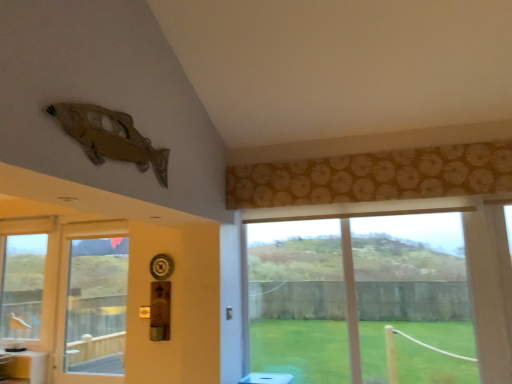
Question: From the image's perspective, is transparent glass door at left located above white glossy counter top at lower left?

Choices:
 (A) yes
 (B) no

Answer: (A)

Question: Is white glossy counter top at lower left at the back of transparent glass door at left?

Choices:
 (A) no
 (B) yes

Answer: (A)

Question: Considering the relative sizes of transparent glass door at left and white glossy counter top at lower left in the image provided, is transparent glass door at left wider than white glossy counter top at lower left?

Choices:
 (A) no
 (B) yes

Answer: (A)

Question: Does transparent glass door at left appear on the right side of white glossy counter top at lower left?

Choices:
 (A) yes
 (B) no

Answer: (A)

Question: Is transparent glass door at left facing towards white glossy counter top at lower left?

Choices:
 (A) no
 (B) yes

Answer: (A)

Question: Is transparent glass door at left further to the viewer compared to white glossy counter top at lower left?

Choices:
 (A) yes
 (B) no

Answer: (B)

Question: From the image's perspective, does metallic brass door handle at lower center appear lower than transparent glass door at left?

Choices:
 (A) no
 (B) yes

Answer: (A)

Question: Can you confirm if metallic brass door handle at lower center is positioned to the left of transparent glass door at left?

Choices:
 (A) yes
 (B) no

Answer: (B)

Question: Considering the relative positions of metallic brass door handle at lower center and transparent glass door at left in the image provided, is metallic brass door handle at lower center to the right of transparent glass door at left from the viewer's perspective?

Choices:
 (A) yes
 (B) no

Answer: (A)

Question: Can you see metallic brass door handle at lower center touching transparent glass door at left?

Choices:
 (A) no
 (B) yes

Answer: (A)

Question: Is metallic brass door handle at lower center aimed at transparent glass door at left?

Choices:
 (A) yes
 (B) no

Answer: (B)

Question: From the image's perspective, is metallic brass door handle at lower center on top of transparent glass door at left?

Choices:
 (A) yes
 (B) no

Answer: (A)

Question: Considering the relative sizes of matte brown curtain at upper center and metallic brass door handle at lower center in the image provided, is matte brown curtain at upper center shorter than metallic brass door handle at lower center?

Choices:
 (A) yes
 (B) no

Answer: (B)